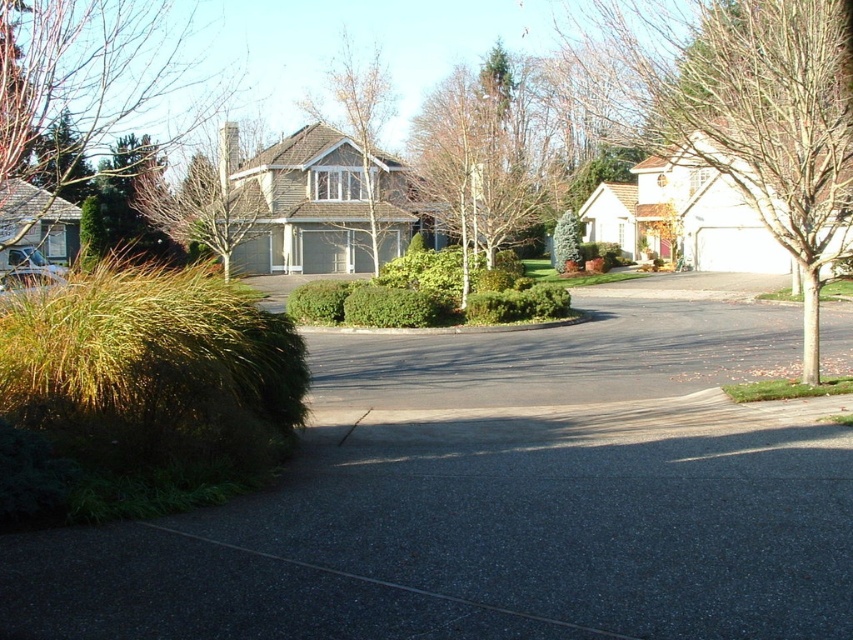
You are a gardener planning to trim both the brown textured tree at center and the green leafy hedge at center. Considering their heights, which one would require a ladder to reach the top?

The brown textured tree at center is much taller than the green leafy hedge at center, so the gardener would need a ladder to trim the brown textured tree at center.

Consider the image. You are a gardener planning to plant a new tree in this suburban yard. The bare wood tree at right and the brown textured tree at center are already present. Which existing tree has a wider trunk to consider for spacing?

The bare wood tree at right has a wider trunk than the brown textured tree at center, so it requires more space.

You are a gardener planning to plant a new tree in this suburban street scene. Considering the positions of the existing bare wood tree at right and brown textured tree at center, which tree would you need to consider for potential shading issues if you want to plant a new tree that requires full sunlight?

Answer: The brown textured tree at center is above the bare wood tree at right, so it would cast more shade. Therefore, you should consider the brown textured tree at center for potential shading issues when planting a new tree that requires full sunlight.